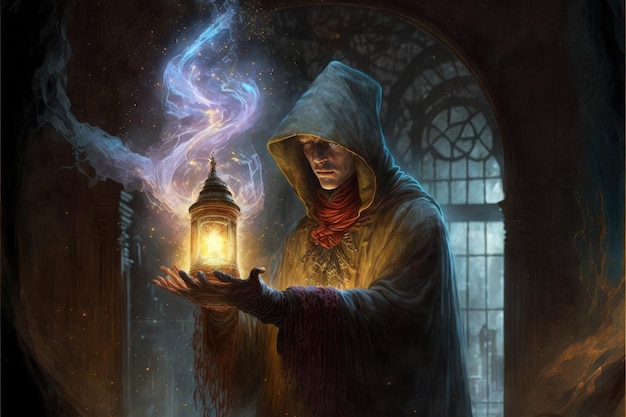
What are the coordinates of `light in lantern` in the screenshot? It's located at (216, 241).